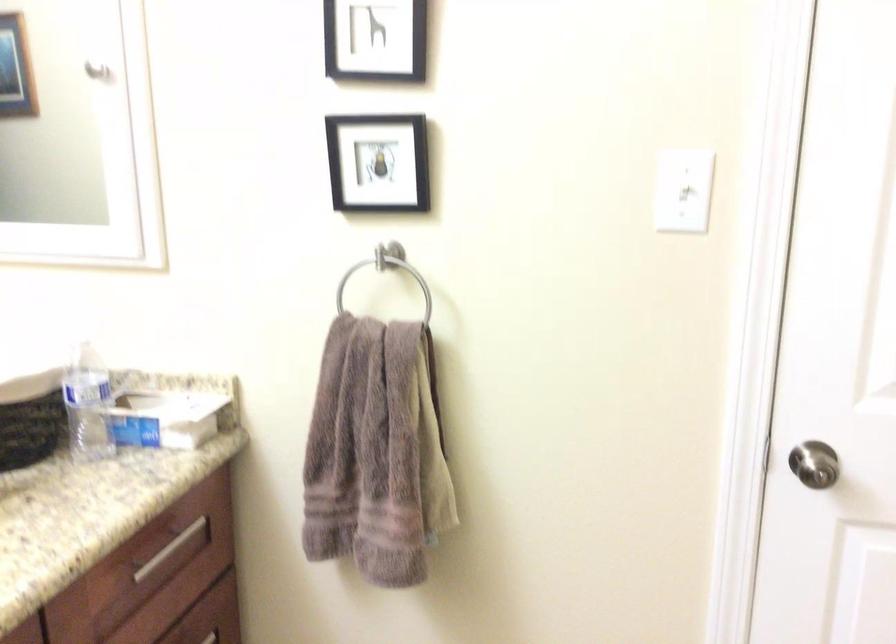
I want to click on silver door knob, so click(x=814, y=464).